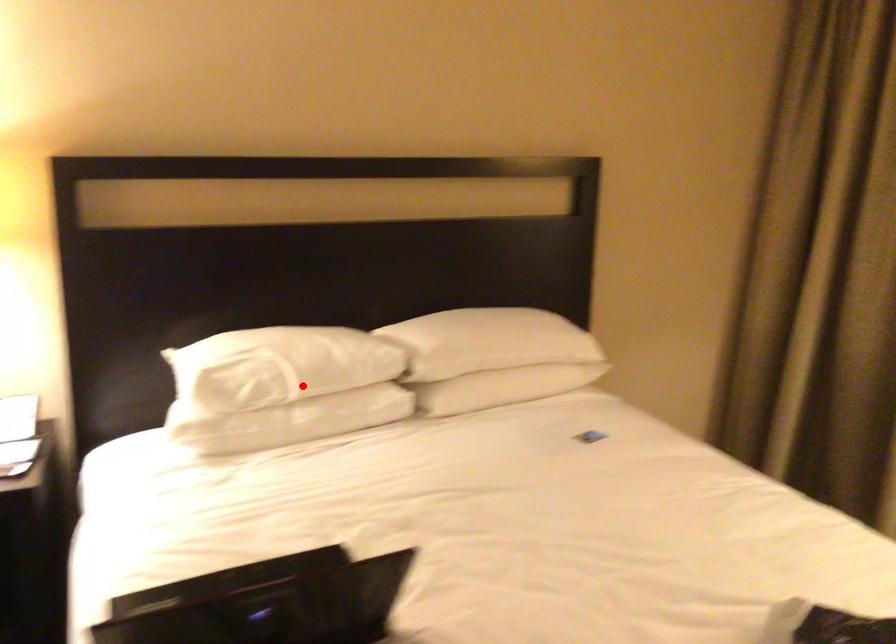
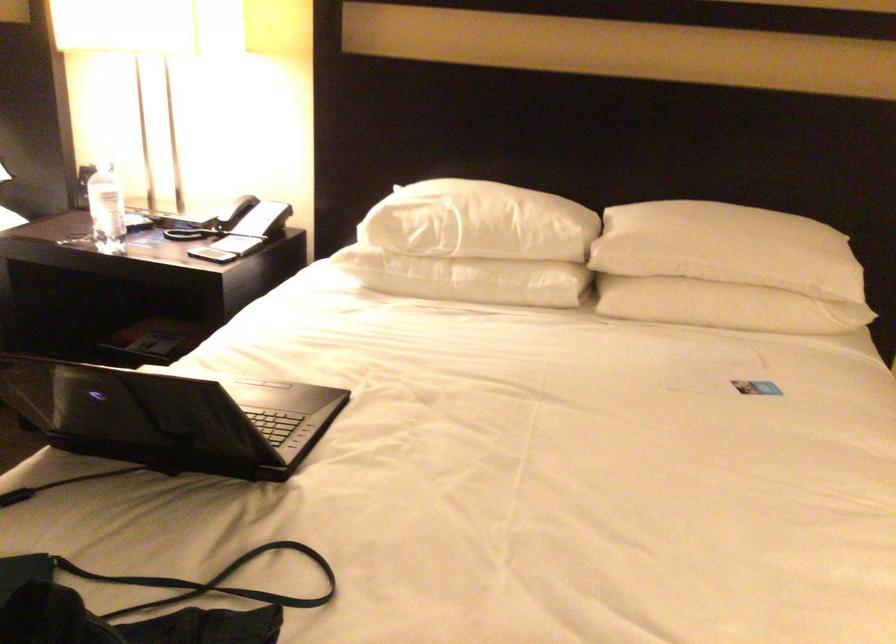
Locate, in the second image, the point that corresponds to the highlighted location in the first image.

(474, 245)